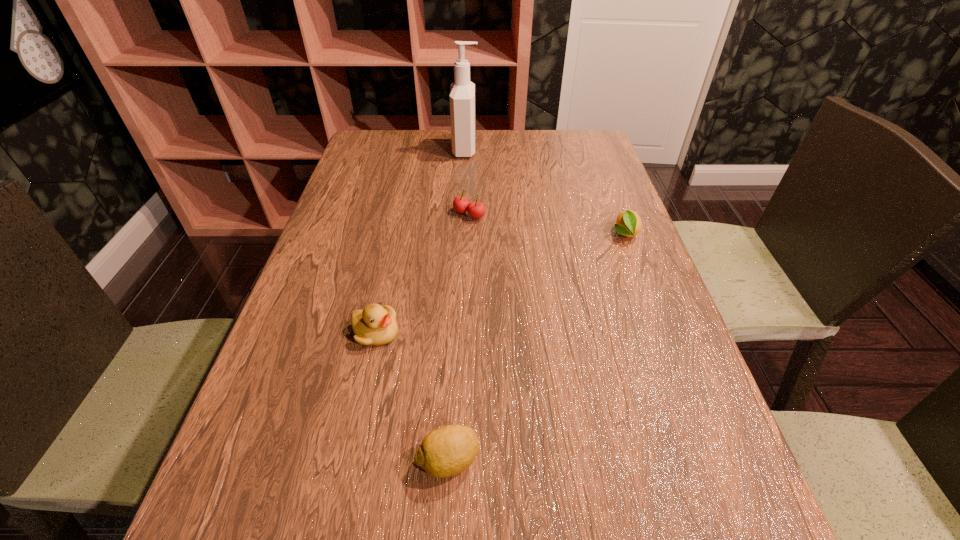
At what (x,y) coordinates should I click in order to perform the action: click on vacant region at the far left corner. Please return your answer as a coordinate pair (x, y). This screenshot has width=960, height=540. Looking at the image, I should click on (395, 154).

This screenshot has height=540, width=960. What are the coordinates of `vacant space at the far right corner` in the screenshot? It's located at (579, 142).

You are a GUI agent. You are given a task and a screenshot of the screen. Output one action in this format:
    pyautogui.click(x=<x>, y=<y>)
    Task: Click on the free spot between the farthest object and the fourth farthest object
    
    Given the screenshot: What is the action you would take?
    pyautogui.click(x=420, y=241)

This screenshot has width=960, height=540. Identify the location of unoccupied position between the left lemon and the cherry. (459, 338).

Identify the location of free space between the cherry and the cleansing agent. (468, 182).

You are a GUI agent. You are given a task and a screenshot of the screen. Output one action in this format:
    pyautogui.click(x=<x>, y=<y>)
    Task: Click on the unoccupied area between the duckling and the farther lemon
    The width and height of the screenshot is (960, 540).
    Given the screenshot: What is the action you would take?
    tap(500, 283)

Image resolution: width=960 pixels, height=540 pixels. What are the coordinates of `free space between the cherry and the leftmost object` in the screenshot? It's located at 422,273.

Identify the location of free space between the right lemon and the farthest object. The height and width of the screenshot is (540, 960). (545, 192).

The image size is (960, 540). What are the coordinates of `free area in between the leftmost object and the right lemon` in the screenshot? It's located at (500, 283).

Image resolution: width=960 pixels, height=540 pixels. Find the location of `vacant area between the rightmost object and the cleansing agent`. vacant area between the rightmost object and the cleansing agent is located at coordinates (545, 192).